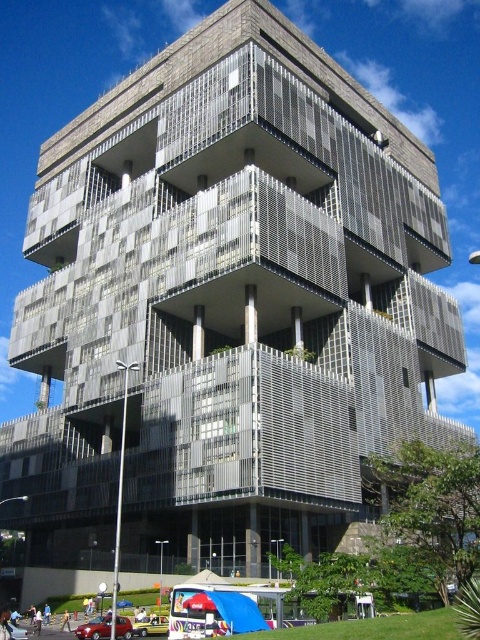
You are a delivery driver who needs to park your truck, which is 6 meters long, in the parking lot near the yellow matte car at lower center and the metallic silver car at lower left. Based on the scene, can you determine if there is enough space between these two cars to park your truck?

The yellow matte car at lower center is shorter than the metallic silver car at lower left. However, the exact distance between them isn not provided in the scene description. Therefore, it is uncertain if there is sufficient space to park a 6 meter long truck between them.

You are standing on the sidewalk in front of the modern building and see the matte red car at lower left and the yellow matte car at lower center. Which car is positioned higher relative to the ground level?

The matte red car at lower left is positioned higher relative to the ground level than the yellow matte car at lower center because it is above it.

Looking at this image, you are a pedestrian standing on the sidewalk in front of the building. You see the yellow matte car at lower center and the metallic silver car at lower left. Which car is closer to you?

The yellow matte car at lower center is closer to you because the metallic silver car at lower left is behind it.